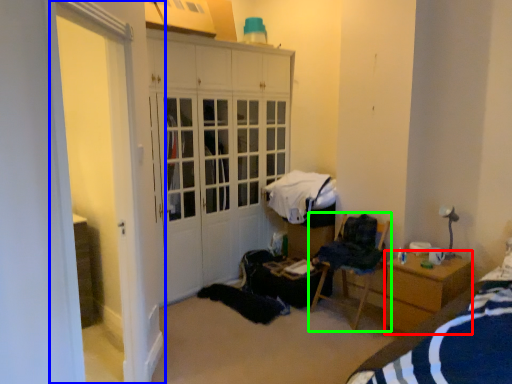
Question: Which object is the farthest from desk (highlighted by a red box)? Choose among these: screen door (highlighted by a blue box) or chair (highlighted by a green box).

Choices:
 (A) screen door
 (B) chair

Answer: (A)